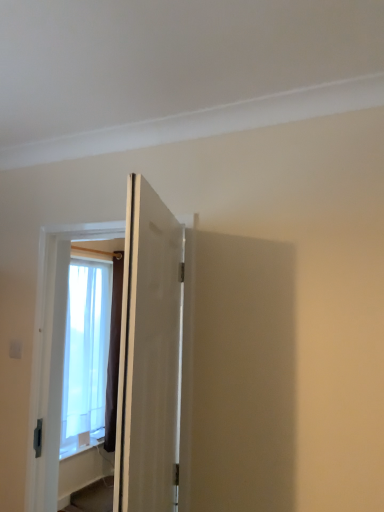
Question: Can you confirm if translucent fabric window at left is wider than matte white door at center, which appears as the second door when viewed from the back?

Choices:
 (A) no
 (B) yes

Answer: (B)

Question: Is translucent fabric window at left to the right of matte white door at center, which appears as the first door when viewed from the front, from the viewer's perspective?

Choices:
 (A) no
 (B) yes

Answer: (A)

Question: Are translucent fabric window at left and matte white door at center, which appears as the first door when viewed from the front, far apart?

Choices:
 (A) no
 (B) yes

Answer: (B)

Question: Considering the relative sizes of translucent fabric window at left and matte white door at center, which appears as the second door when viewed from the back, in the image provided, is translucent fabric window at left thinner than matte white door at center, which appears as the second door when viewed from the back,?

Choices:
 (A) no
 (B) yes

Answer: (A)

Question: Can matte white door at center, which appears as the second door when viewed from the back, be found inside translucent fabric window at left?

Choices:
 (A) yes
 (B) no

Answer: (B)

Question: Is matte white door at center, which appears as the second door when viewed from the back, to the left or to the right of white matte door at center, placed as the 2th door when sorted from front to back, in the image?

Choices:
 (A) left
 (B) right

Answer: (B)

Question: Would you say matte white door at center, which appears as the first door when viewed from the front, is inside or outside white matte door at center, marked as the 1th door in a back-to-front arrangement?

Choices:
 (A) inside
 (B) outside

Answer: (B)

Question: Is matte white door at center, which appears as the second door when viewed from the back, wider or thinner than white matte door at center, placed as the 2th door when sorted from front to back?

Choices:
 (A) thin
 (B) wide

Answer: (A)

Question: Looking at the image, does matte white door at center, which appears as the first door when viewed from the front, seem bigger or smaller compared to white matte door at center, placed as the 2th door when sorted from front to back?

Choices:
 (A) small
 (B) big

Answer: (A)

Question: In terms of height, does translucent fabric window at left look taller or shorter compared to white matte door at center, placed as the 2th door when sorted from front to back?

Choices:
 (A) short
 (B) tall

Answer: (B)

Question: Considering the positions of point (92, 262) and point (148, 398), is point (92, 262) closer or farther from the camera than point (148, 398)?

Choices:
 (A) closer
 (B) farther

Answer: (B)

Question: In the image, is translucent fabric window at left positioned in front of or behind white matte door at center, marked as the 1th door in a back-to-front arrangement?

Choices:
 (A) behind
 (B) front

Answer: (A)

Question: Is translucent fabric window at left inside the boundaries of white matte door at center, marked as the 1th door in a back-to-front arrangement, or outside?

Choices:
 (A) inside
 (B) outside

Answer: (B)

Question: Based on their positions, is white matte door at center, placed as the 2th door when sorted from front to back, located to the left or right of matte white door at center, which appears as the first door when viewed from the front?

Choices:
 (A) left
 (B) right

Answer: (A)

Question: From a real-world perspective, relative to matte white door at center, which appears as the second door when viewed from the back, is white matte door at center, placed as the 2th door when sorted from front to back, vertically above or below?

Choices:
 (A) below
 (B) above

Answer: (A)